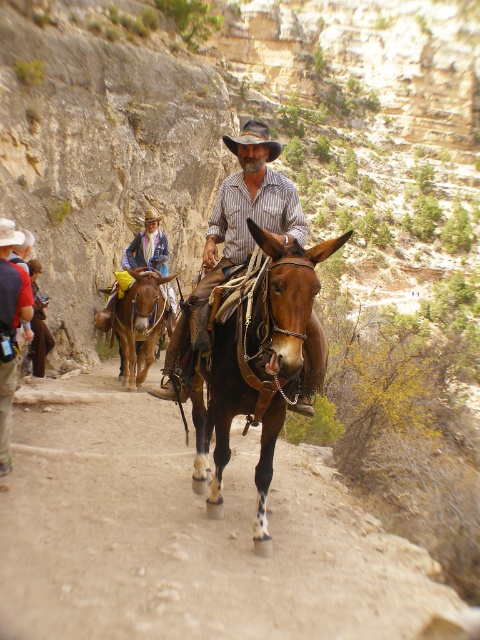
You are a hiker standing at the starting point of the trail. You see the brown leather donkey at center. Based on its 2D location coordinates, can you determine if it is positioned to the left or right side of the trail?

The brown leather donkey at center is located at coordinates point (255, 369). Since the x coordinate is 0.577, which is greater than 0.5, it is positioned to the right side of the trail.

You are planning to ride one of the two mules, the brown leather donkey at center and the brown leather mule at center. Which one has a wider body?

The brown leather donkey at center has a larger width than the brown leather mule at center according to the description.